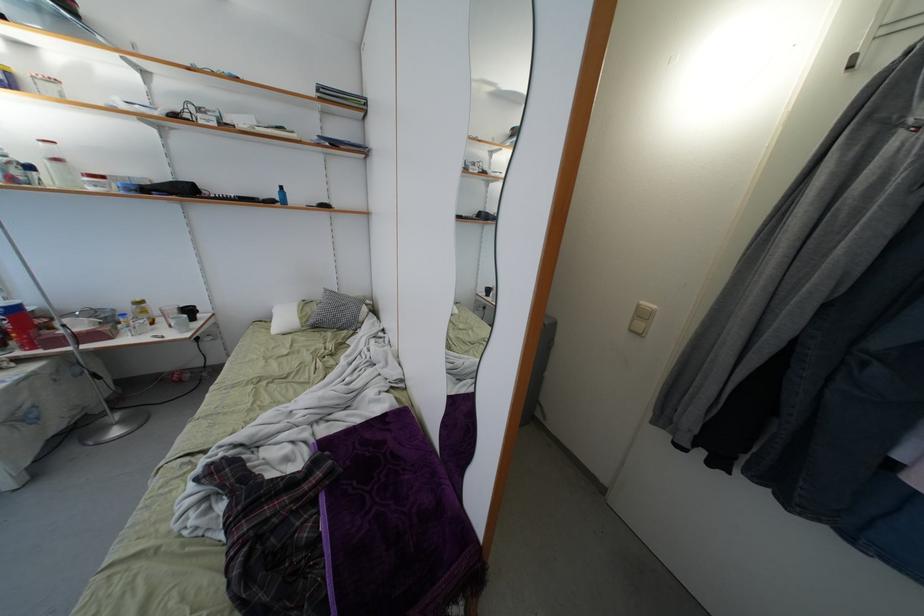
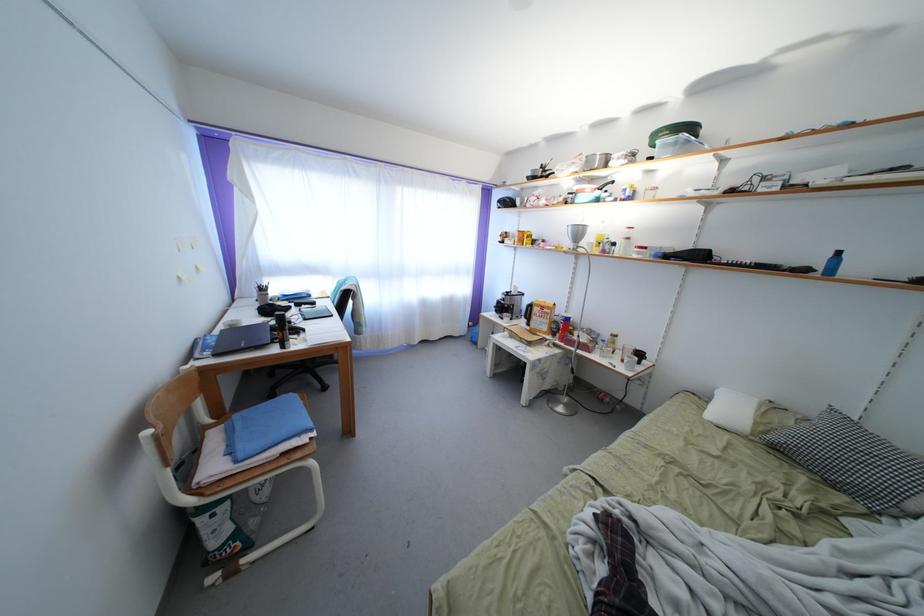
The point at (165, 325) is marked in the first image. Where is the corresponding point in the second image?

(624, 359)